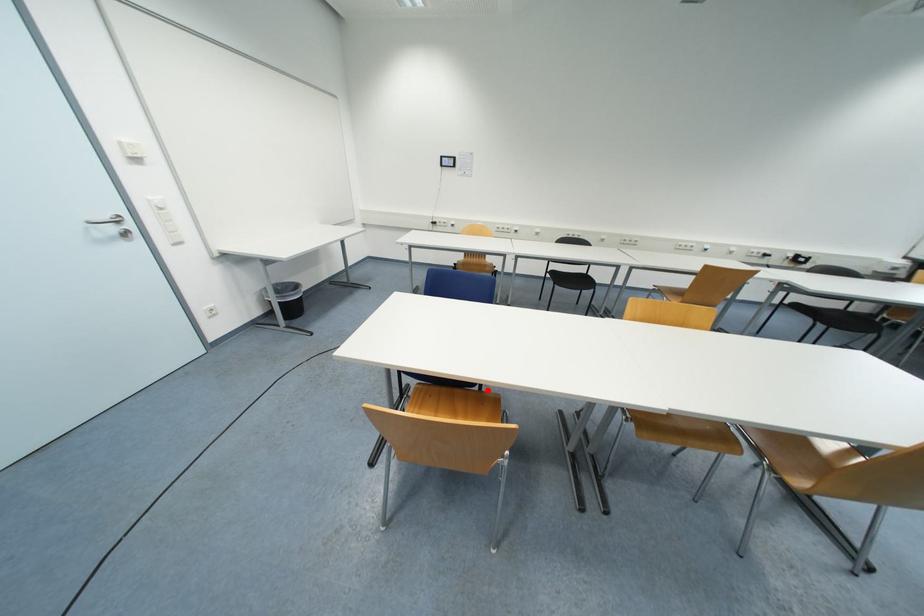
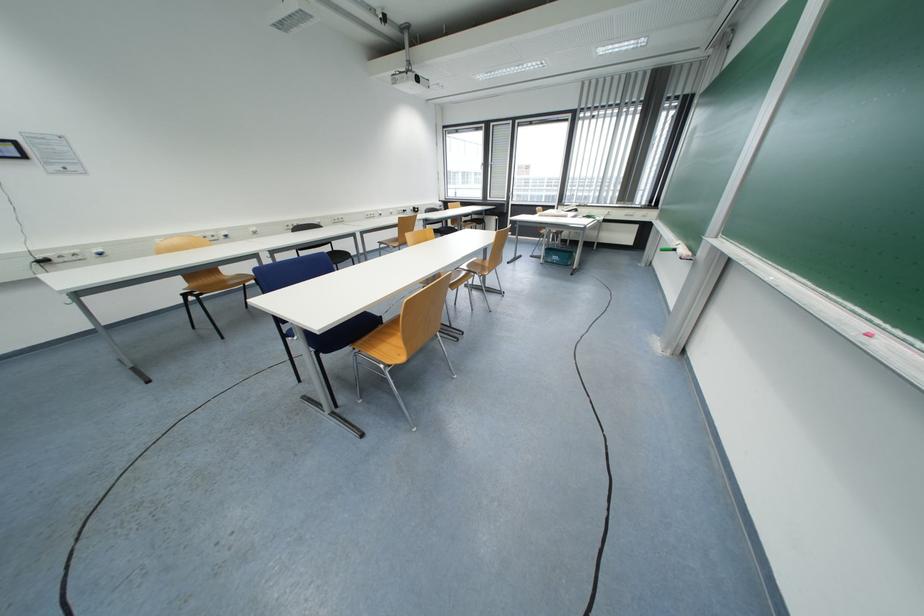
Locate, in the second image, the point that corresponds to the highlighted location in the first image.

(390, 323)